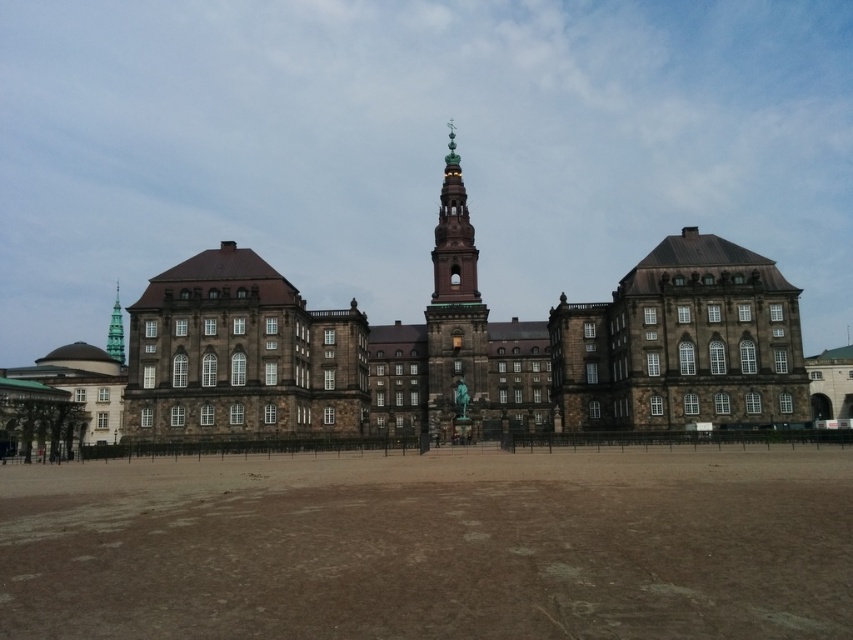
Question: Which of the following is the farthest from the observer?

Choices:
 (A) green copper bell tower at center
 (B) brown sandy ground at center
 (C) brown stone bell tower at center
 (D) green glass bell tower at upper center

Answer: (D)

Question: Is brown sandy ground at center smaller than brown stone bell tower at center?

Choices:
 (A) yes
 (B) no

Answer: (B)

Question: Which object is positioned closest to the brown stone bell tower at center?

Choices:
 (A) green glass bell tower at upper center
 (B) brown stone building at center
 (C) brown sandy ground at center
 (D) green copper bell tower at center

Answer: (D)

Question: Which of the following is the closest to the observer?

Choices:
 (A) brown stone bell tower at center
 (B) brown sandy ground at center
 (C) brown stone building at center
 (D) green glass bell tower at upper center

Answer: (B)

Question: In this image, where is brown sandy ground at center located relative to green copper bell tower at center?

Choices:
 (A) right
 (B) left

Answer: (B)

Question: Can you confirm if brown sandy ground at center is positioned to the left of brown stone bell tower at center?

Choices:
 (A) yes
 (B) no

Answer: (A)